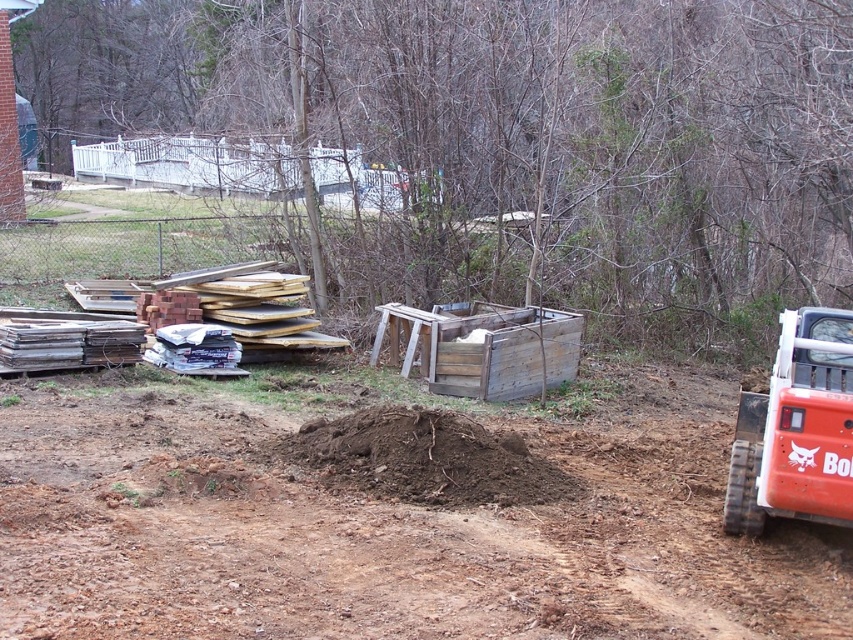
You are a construction worker who needs to place a 10cm tall tool box on the ground. You have two options in the scene, the brown soil at center and the weathered wood crate at center. Which surface can you choose to ensure the tool box won

The brown soil at center has a lesser height compared to the weathered wood crate at center. Since the tool box is 10cm tall, placing it on the weathered wood crate at center would provide a stable base as it is higher and likely more level than the uneven soil.

You are a construction worker who needs to move the weathered wood crate at center to the storage area. However, there is brown soil at lower right blocking the path. Can you move the crate without disturbing the soil?

The brown soil at lower right is in front of the weathered wood crate at center, so you can move the crate by lifting it over the soil or moving it around the soil if there is space, but you cannot move it directly through the soil without disturbing it.

You are a construction worker who needs to move a heavy tool from the orange rubber track at right to the brown soil at lower right. Can you safely move it directly without needing to go around?

The brown soil at lower right is in front of the orange rubber track at right, so the path between them is unobstructed. Yes, you can move the tool directly from the orange rubber track at right to the brown soil at lower right safely.